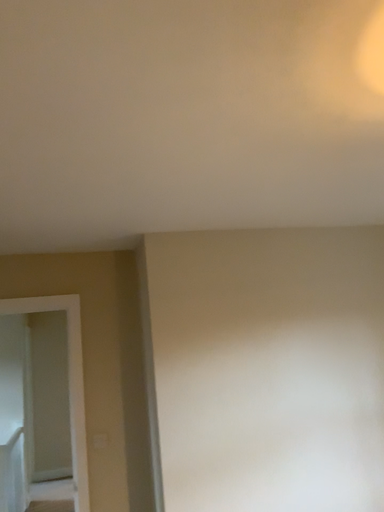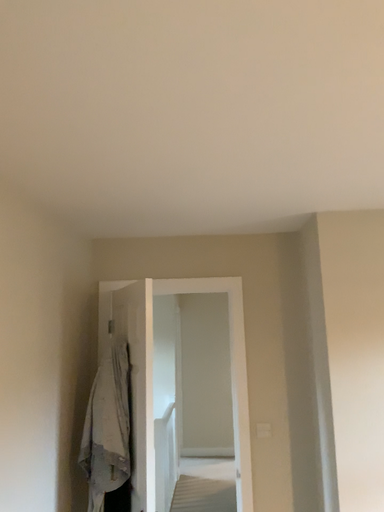
Question: Which way did the camera rotate in the video?

Choices:
 (A) rotated right
 (B) rotated left

Answer: (B)